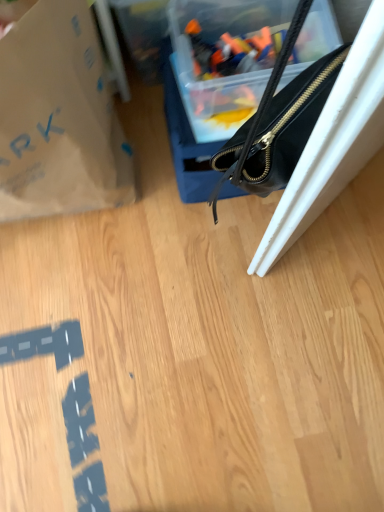
Locate an element on the screen. The image size is (384, 512). space that is in front of brown paper bag at upper left is located at coordinates (88, 292).